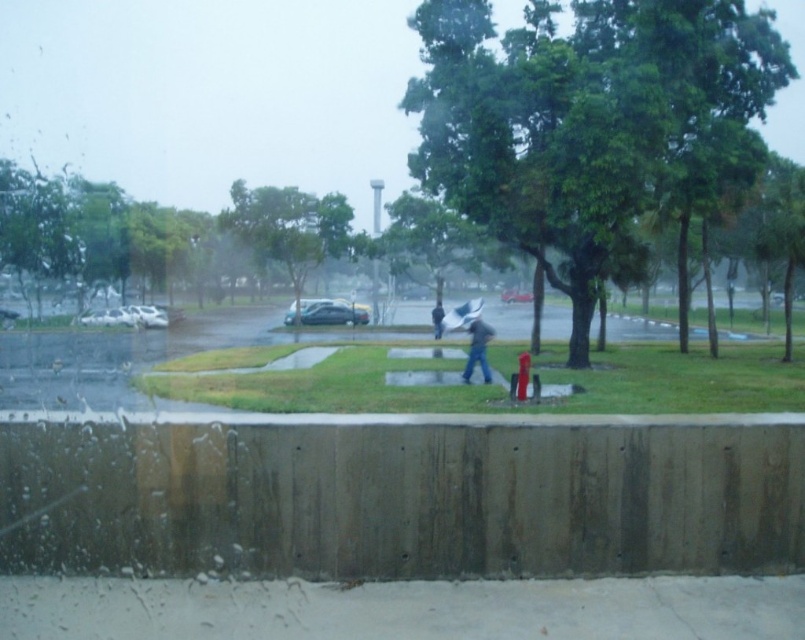
You are driving in the rain and notice a gray concrete pavement at lower center and a black matte umbrella at center through the windshield. Which object appears wider from your viewpoint inside the car?

The gray concrete pavement at lower center might be wider than black matte umbrella at center according to the description.

You are a pedestrian trying to cross the street. You see the gray concrete pavement at lower center and the black matte umbrella at center. Which object is closer to you?

The gray concrete pavement at lower center is closer to the viewer than the black matte umbrella at center.